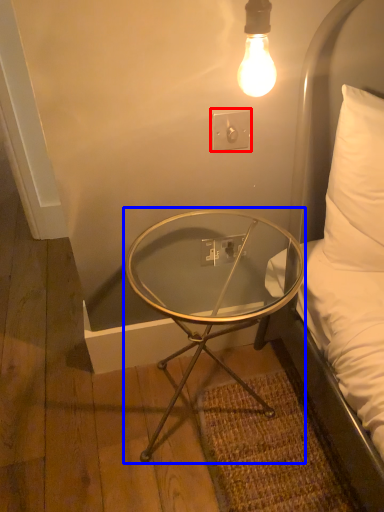
Question: Among these objects, which one is nearest to the camera, electric outlet (highlighted by a red box) or coffee table (highlighted by a blue box)?

Choices:
 (A) electric outlet
 (B) coffee table

Answer: (B)